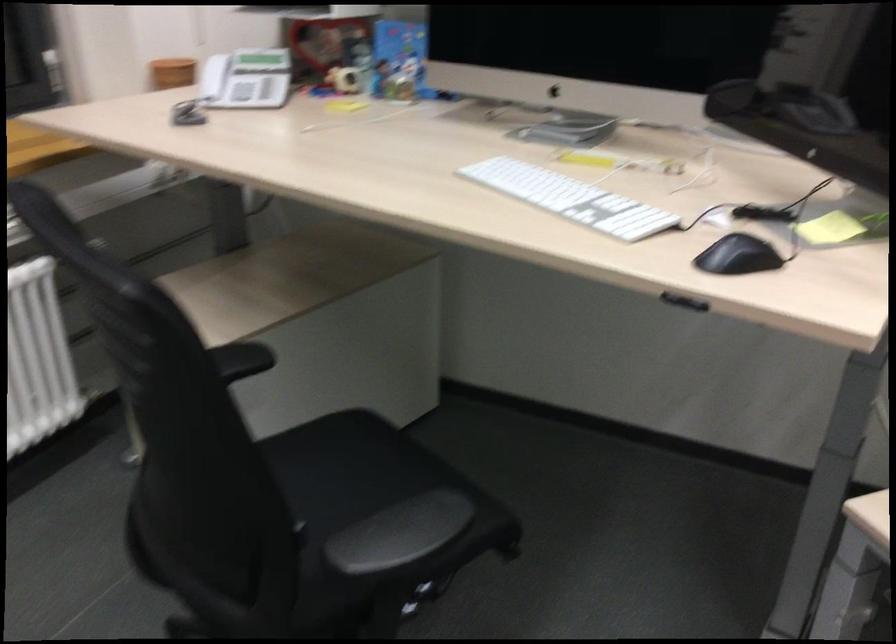
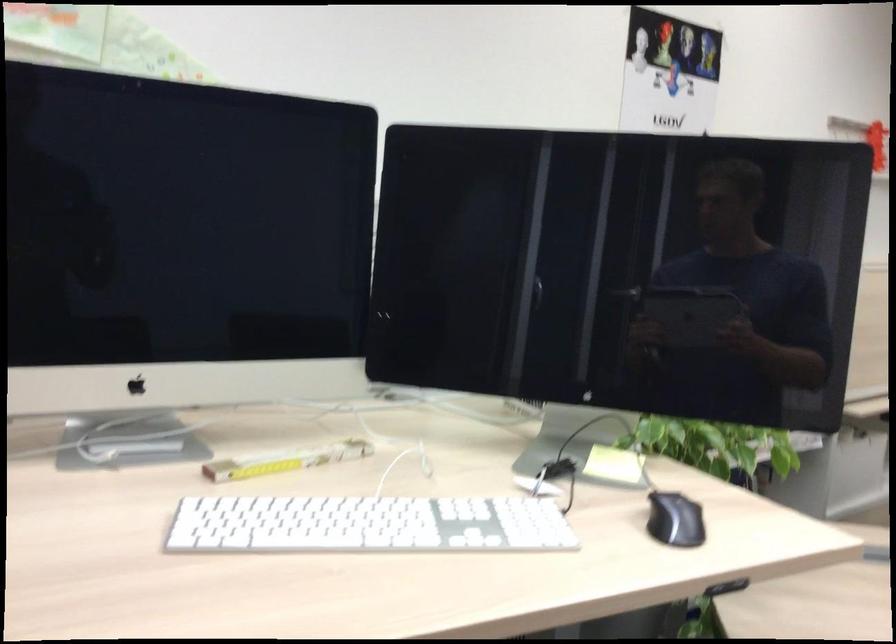
Question: The camera is either moving clockwise (left) or counter-clockwise (right) around the object. The first image is from the beginning of the video and the second image is from the end. Is the camera moving left or right when shooting the video?

Choices:
 (A) Left
 (B) Right

Answer: (A)